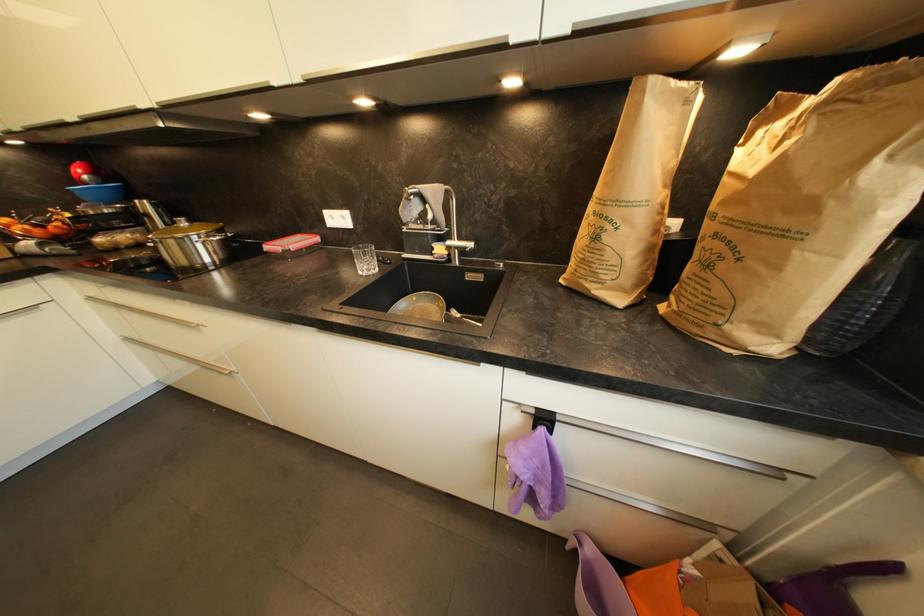
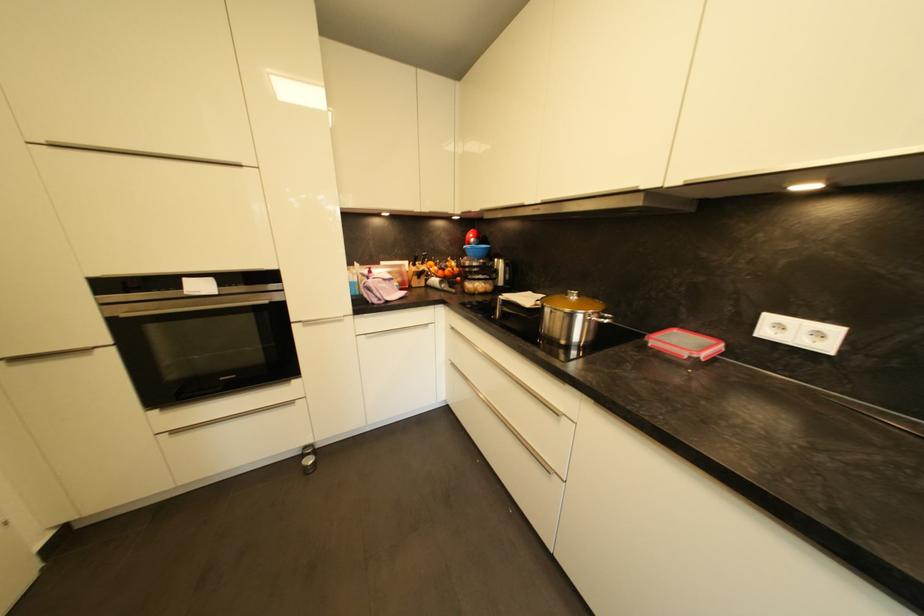
Locate, in the second image, the point that corresponds to point 193,224 in the first image.

(584, 298)